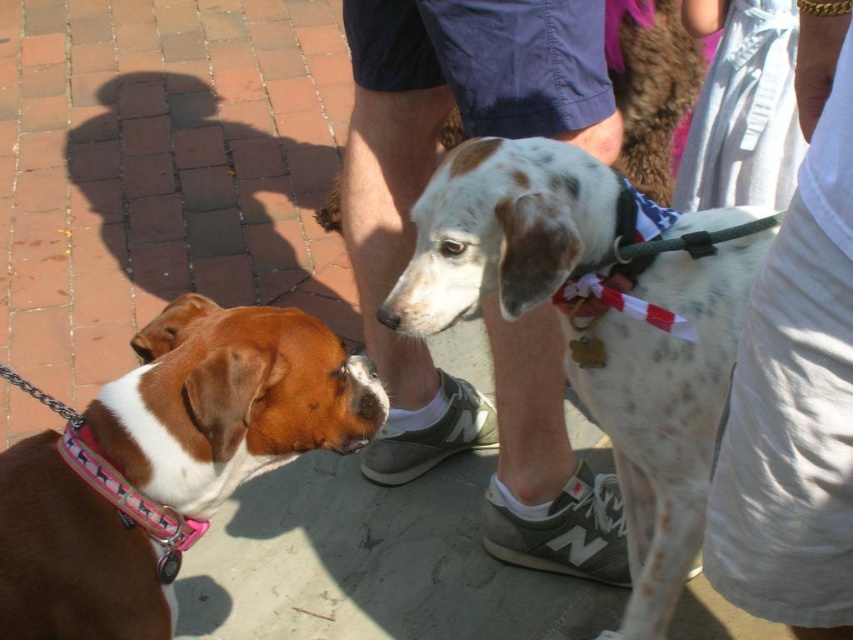
Question: Can you confirm if white cotton shirt at right is wider than pink fabric neckband at lower left?

Choices:
 (A) no
 (B) yes

Answer: (A)

Question: Is speckled white dog at center to the left of white cotton shirt at right from the viewer's perspective?

Choices:
 (A) yes
 (B) no

Answer: (A)

Question: Which point appears closest to the camera in this image?

Choices:
 (A) (142, 419)
 (B) (784, 595)
 (C) (194, 538)

Answer: (B)

Question: Which point is closer to the camera?

Choices:
 (A) (155, 509)
 (B) (479, 282)

Answer: (A)

Question: Is brown and white fur at left closer to the viewer compared to white cotton shirt at right?

Choices:
 (A) no
 (B) yes

Answer: (A)

Question: Estimate the real-world distances between objects in this image. Which object is closer to the white cotton shirt at right?

Choices:
 (A) pink fabric neckband at lower left
 (B) brown and white fur at left
 (C) speckled white dog at center

Answer: (C)